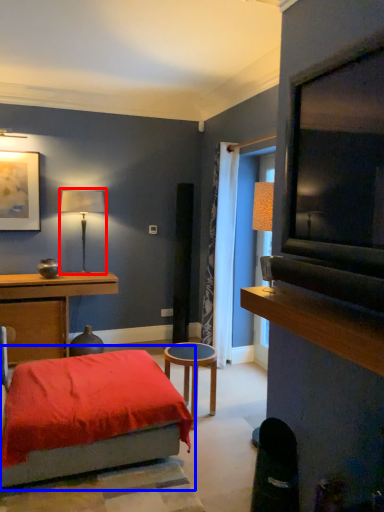
Question: Which point is closer to the camera, table lamp (highlighted by a red box) or bed (highlighted by a blue box)?

Choices:
 (A) table lamp
 (B) bed

Answer: (B)